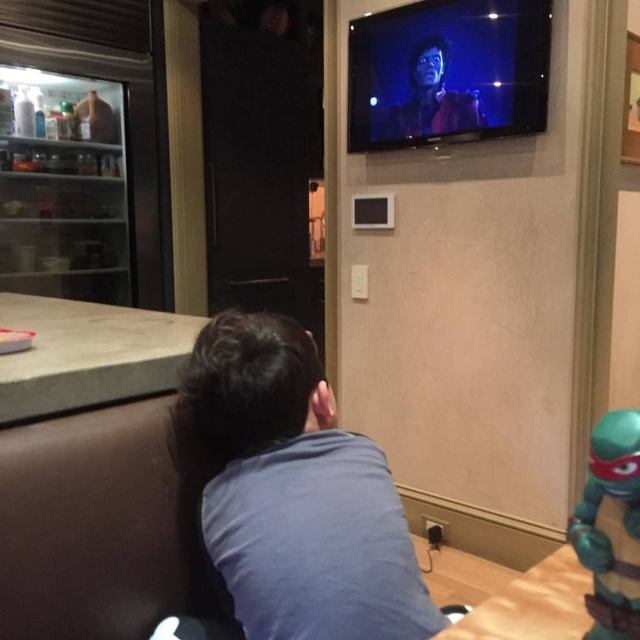
Can you confirm if blue cotton shirt at center is positioned above teal plastic turtle at lower right?

Actually, blue cotton shirt at center is below teal plastic turtle at lower right.

Based on the photo, can you confirm if blue cotton shirt at center is taller than teal plastic turtle at lower right?

Yes, blue cotton shirt at center is taller than teal plastic turtle at lower right.

Locate an element on the screen. This screenshot has height=640, width=640. blue cotton shirt at center is located at coordinates (292, 492).

Locate an element on the screen. blue cotton shirt at center is located at coordinates (292, 492).

Is blue cotton shirt at center further to the viewer compared to shiny red leather jacket at upper center?

No, blue cotton shirt at center is in front of shiny red leather jacket at upper center.

Is blue cotton shirt at center shorter than shiny red leather jacket at upper center?

Incorrect, blue cotton shirt at center's height does not fall short of shiny red leather jacket at upper center's.

Is point (310, 387) farther from camera compared to point (413, 125)?

No.

Image resolution: width=640 pixels, height=640 pixels. I want to click on blue cotton shirt at center, so click(x=292, y=492).

Measure the distance between teal plastic turtle at lower right and camera.

20.93 inches

How distant is teal plastic turtle at lower right from shiny red leather jacket at upper center?

teal plastic turtle at lower right is 6.60 feet away from shiny red leather jacket at upper center.

What are the coordinates of `teal plastic turtle at lower right` in the screenshot? It's located at (611, 525).